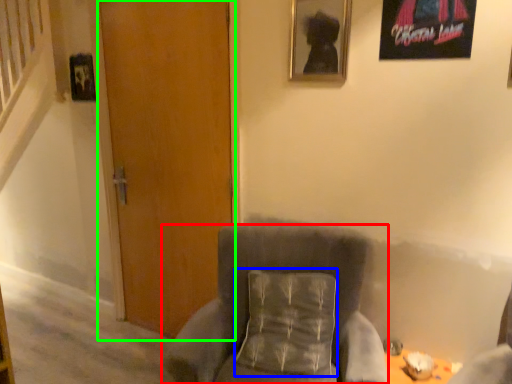
Question: Which object is the farthest from chair (highlighted by a red box)? Choose among these: pillow (highlighted by a blue box) or door (highlighted by a green box).

Choices:
 (A) pillow
 (B) door

Answer: (B)